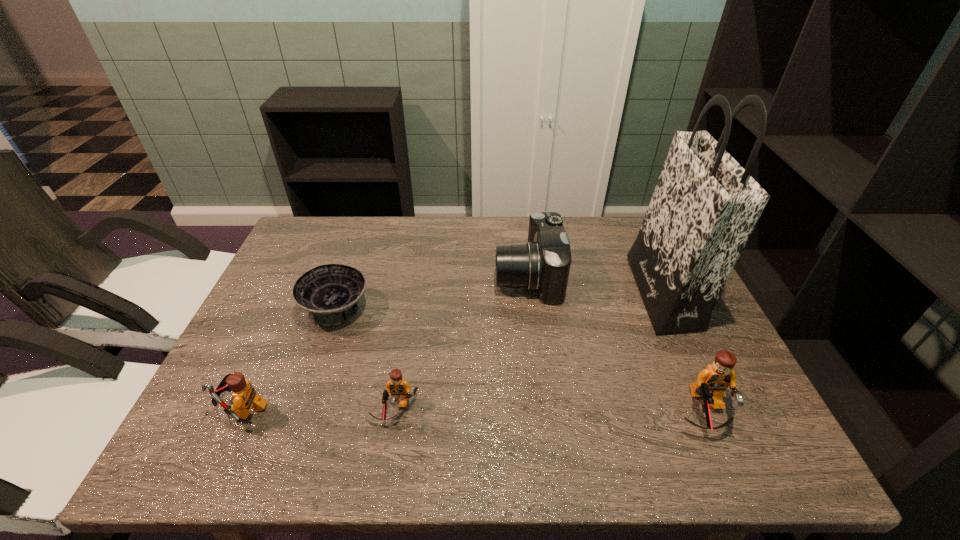
This screenshot has width=960, height=540. Identify the location of the third shortest object. (244, 396).

At what (x,y) coordinates should I click in order to perform the action: click on the second shortest Lego. Please return your answer as a coordinate pair (x, y). The width and height of the screenshot is (960, 540). Looking at the image, I should click on (244, 396).

Identify the location of the shortest Lego. The width and height of the screenshot is (960, 540). 399,388.

Where is `the third object from left to right`? the third object from left to right is located at coordinates (399, 388).

The width and height of the screenshot is (960, 540). I want to click on the tallest Lego, so 712,382.

The height and width of the screenshot is (540, 960). I want to click on the third object from right to left, so click(543, 265).

Find the location of a particular element. bowl is located at coordinates (330, 293).

Where is `shopping bag`? This screenshot has width=960, height=540. shopping bag is located at coordinates (705, 205).

Where is `free space located 0.100m on the lens of the camera`? free space located 0.100m on the lens of the camera is located at coordinates (461, 276).

What are the coordinates of `free spot located 0.380m on the lens of the camera` in the screenshot? It's located at click(364, 276).